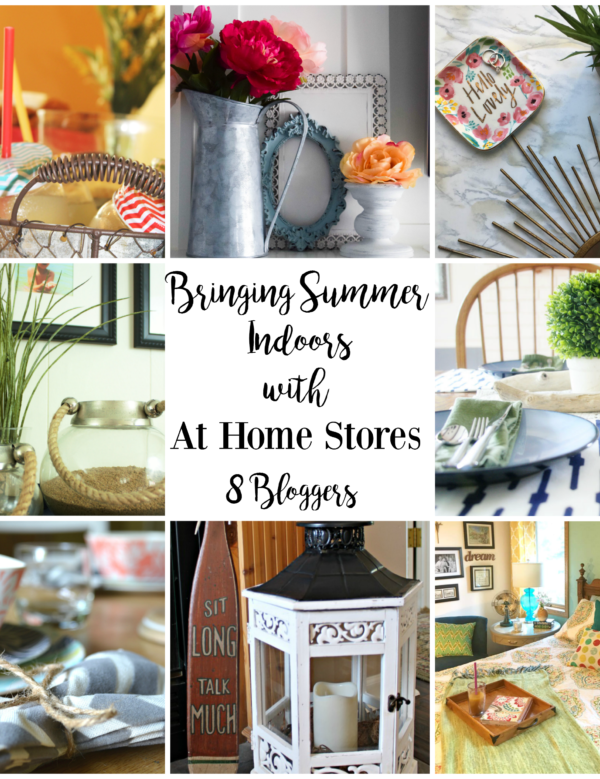
The height and width of the screenshot is (779, 600). I want to click on candle, so click(x=339, y=714).